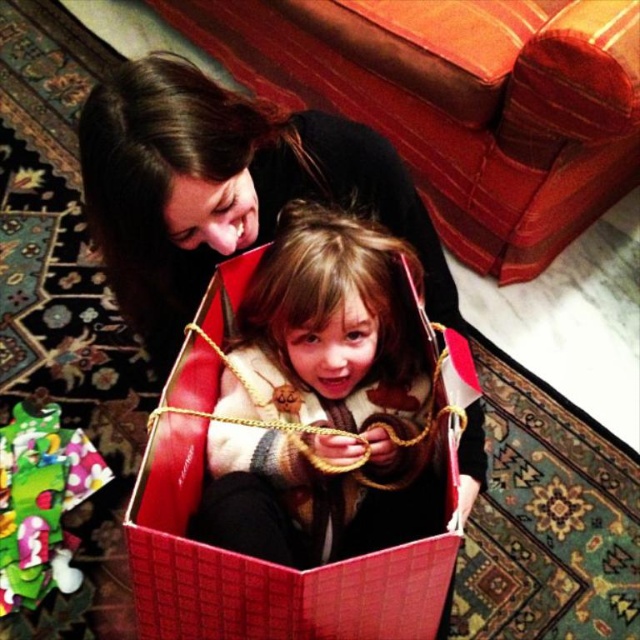
You are helping organize a closet and see the plaid sweater at center and the matte black sweater at upper left. Which sweater is located lower in the closet?

The plaid sweater at center is positioned under the matte black sweater at upper left, so it is located lower in the closet.

You are helping organize a clothing store. You have two sweaters to display on a rack. The plaid sweater at center and the matte black sweater at upper left. The rack has a width limit of 1 meter. Which sweater can fit better on the rack without exceeding the width limit?

The plaid sweater at center has a lesser width compared to the matte black sweater at upper left, so it can fit better on the rack without exceeding the width limit.